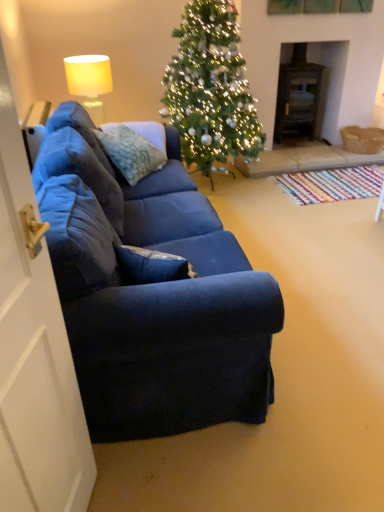
Question: Is dark wood fireplace at center right not close to textured blue pillow at center?

Choices:
 (A) yes
 (B) no

Answer: (A)

Question: Can you confirm if dark wood fireplace at center right is bigger than textured blue pillow at center?

Choices:
 (A) yes
 (B) no

Answer: (A)

Question: Is dark wood fireplace at center right further to the viewer compared to textured blue pillow at center?

Choices:
 (A) yes
 (B) no

Answer: (A)

Question: Is dark wood fireplace at center right thinner than textured blue pillow at center?

Choices:
 (A) no
 (B) yes

Answer: (A)

Question: Considering the relative sizes of dark wood fireplace at center right and textured blue pillow at center in the image provided, is dark wood fireplace at center right wider than textured blue pillow at center?

Choices:
 (A) no
 (B) yes

Answer: (B)

Question: From the image's perspective, is dark wood fireplace at center right under textured blue pillow at center?

Choices:
 (A) yes
 (B) no

Answer: (B)

Question: From the image's perspective, would you say white matte door at left is positioned over green matte christmas tree at center?

Choices:
 (A) yes
 (B) no

Answer: (B)

Question: Considering the relative positions of white matte door at left and green matte christmas tree at center in the image provided, is white matte door at left to the right of green matte christmas tree at center from the viewer's perspective?

Choices:
 (A) yes
 (B) no

Answer: (B)

Question: Is white matte door at left positioned with its back to green matte christmas tree at center?

Choices:
 (A) yes
 (B) no

Answer: (B)

Question: Is white matte door at left smaller than green matte christmas tree at center?

Choices:
 (A) yes
 (B) no

Answer: (A)

Question: Does white matte door at left have a lesser width compared to green matte christmas tree at center?

Choices:
 (A) no
 (B) yes

Answer: (B)

Question: Is white matte door at left closer to the viewer compared to green matte christmas tree at center?

Choices:
 (A) no
 (B) yes

Answer: (B)

Question: Is matte yellow fabric lampshade at upper left at the back of green matte christmas tree at center?

Choices:
 (A) no
 (B) yes

Answer: (A)